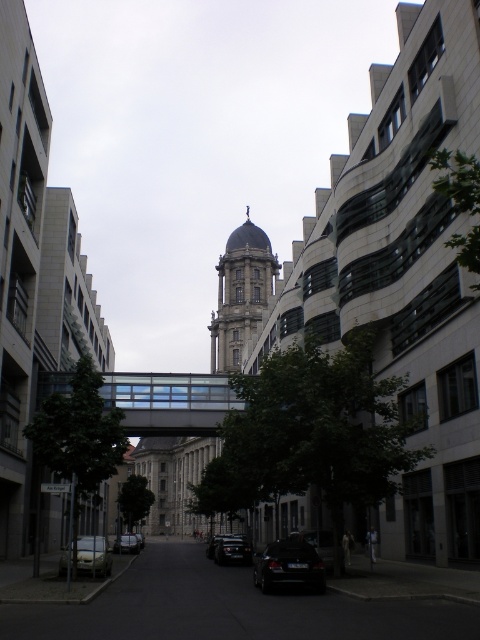
You are a delivery driver who needs to park your vehicle in this urban area. You have two cars available for the task. One is the black matte car at lower center and the other is the black glossy car at center. Considering the space between the modern buildings on the left and the historical building in the center, which car would you choose to park here and why?

The black matte car at lower center has a greater width than the black glossy car at center. Since the space between the modern buildings on the left and the historical building in the center is likely narrow, the narrower black glossy car at center would be easier to maneuver and park in this confined area.

You are a delivery driver who needs to park your black matte car at lower center in a designated parking spot located at coordinates point 0.884, 0.602. Based on the scene description, is the parking spot available for your vehicle?

The black matte car at lower center is already located at point (288, 564), so the parking spot is not available for your vehicle.